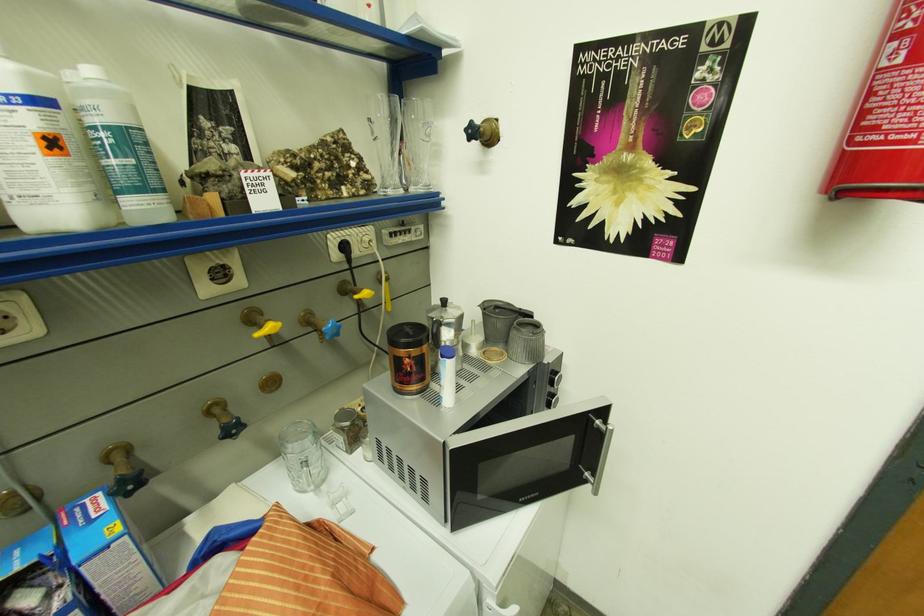
Where is `microwave door handle`? The width and height of the screenshot is (924, 616). microwave door handle is located at coordinates (602, 454).